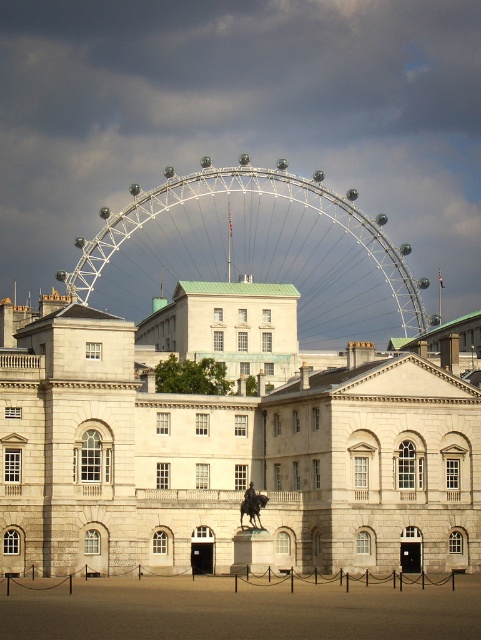
Is white stone palace at center wider than white metallic ferris wheel at center?

No.

Is point (216, 518) positioned in front of point (159, 208)?

That is True.

At what (x,y) coordinates should I click in order to perform the action: click on white stone palace at center. Please return your answer as a coordinate pair (x, y). Looking at the image, I should click on (227, 451).